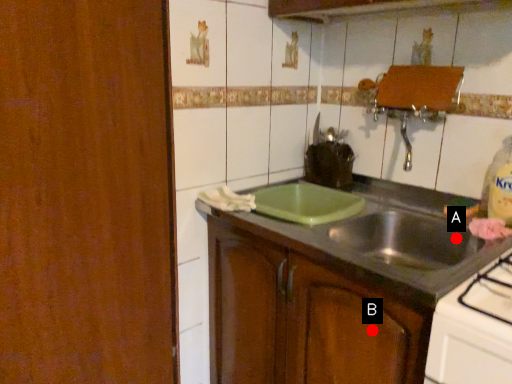
Question: Two points are circled on the image, labeled by A and B beside each circle. Which point is farther from the camera taking this photo?

Choices:
 (A) A is further
 (B) B is further

Answer: (A)